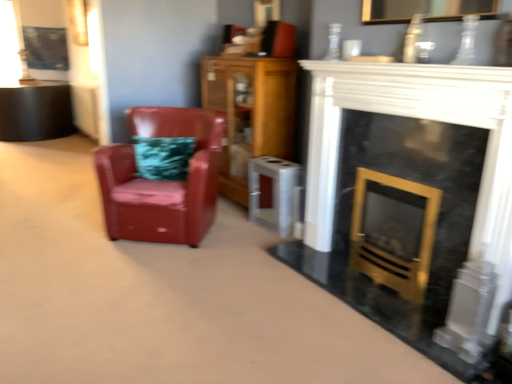
Question: Is glossy leather armchair at left wider than wooden cabinet at center?

Choices:
 (A) no
 (B) yes

Answer: (B)

Question: Is glossy leather armchair at left looking in the opposite direction of wooden cabinet at center?

Choices:
 (A) yes
 (B) no

Answer: (A)

Question: Considering the relative sizes of glossy leather armchair at left and wooden cabinet at center in the image provided, is glossy leather armchair at left smaller than wooden cabinet at center?

Choices:
 (A) yes
 (B) no

Answer: (B)

Question: Can you confirm if glossy leather armchair at left is bigger than wooden cabinet at center?

Choices:
 (A) no
 (B) yes

Answer: (B)

Question: From a real-world perspective, is glossy leather armchair at left positioned over wooden cabinet at center based on gravity?

Choices:
 (A) yes
 (B) no

Answer: (B)

Question: From a real-world perspective, is glossy leather armchair at left positioned under wooden cabinet at center based on gravity?

Choices:
 (A) no
 (B) yes

Answer: (B)

Question: Is metallic silver picture frame at upper left at the back of glossy leather armchair at left?

Choices:
 (A) yes
 (B) no

Answer: (B)

Question: Does glossy leather armchair at left appear on the right side of metallic silver picture frame at upper left?

Choices:
 (A) no
 (B) yes

Answer: (B)

Question: From a real-world perspective, is glossy leather armchair at left under metallic silver picture frame at upper left?

Choices:
 (A) no
 (B) yes

Answer: (B)

Question: Is the position of glossy leather armchair at left less distant than that of metallic silver picture frame at upper left?

Choices:
 (A) no
 (B) yes

Answer: (B)

Question: Considering the relative positions of glossy leather armchair at left and metallic silver picture frame at upper left in the image provided, is glossy leather armchair at left to the left of metallic silver picture frame at upper left from the viewer's perspective?

Choices:
 (A) no
 (B) yes

Answer: (A)

Question: Is glossy leather armchair at left wider than metallic silver picture frame at upper left?

Choices:
 (A) no
 (B) yes

Answer: (B)

Question: Is metallic silver picture frame at upper left positioned before wooden cabinet at center?

Choices:
 (A) yes
 (B) no

Answer: (B)